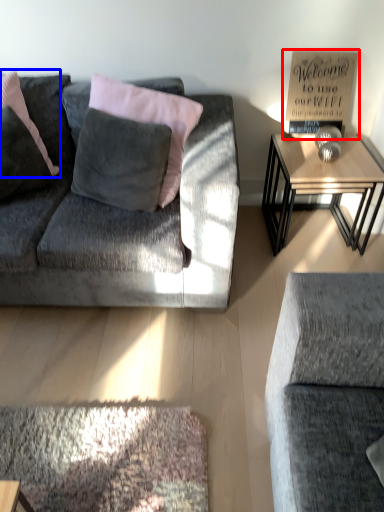
Question: Which point is closer to the camera, bulletin board (highlighted by a red box) or pillow (highlighted by a blue box)?

Choices:
 (A) bulletin board
 (B) pillow

Answer: (B)